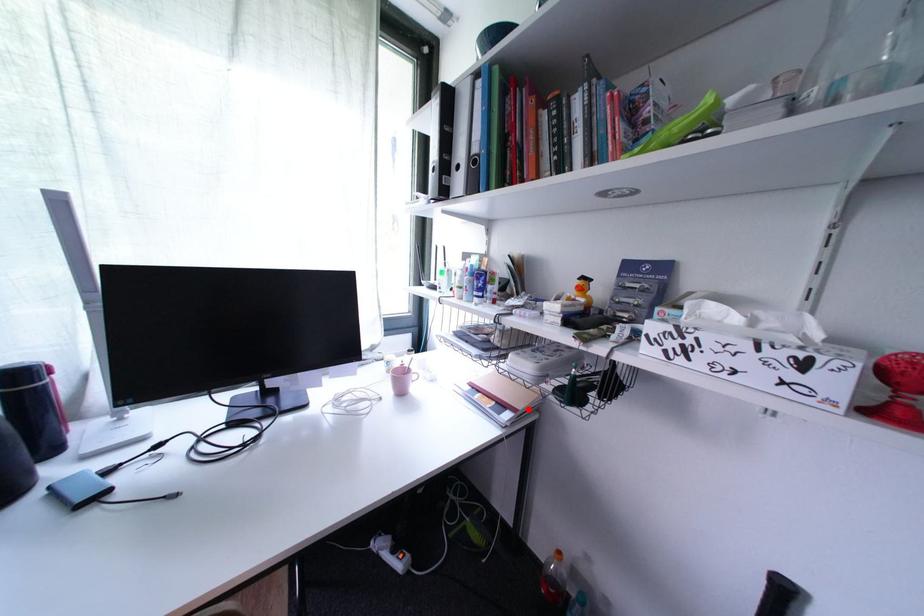
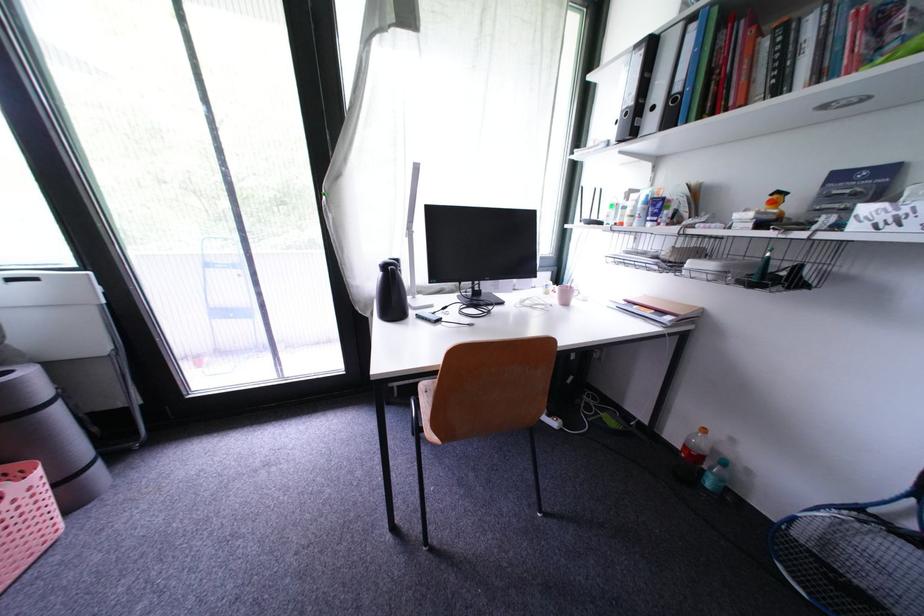
Find the pixel in the second image that matches the highlighted location in the first image.

(689, 315)